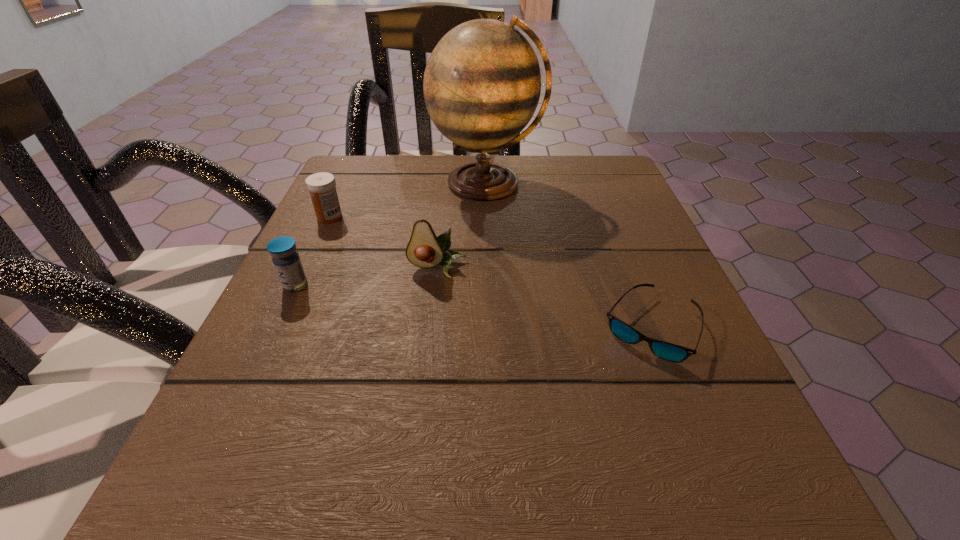
Where is `the tallest object`? The width and height of the screenshot is (960, 540). the tallest object is located at coordinates (482, 83).

Where is `avocado`? The height and width of the screenshot is (540, 960). avocado is located at coordinates (425, 250).

Image resolution: width=960 pixels, height=540 pixels. I want to click on the farther medicine, so click(321, 186).

The width and height of the screenshot is (960, 540). Identify the location of the nearer medicine. (286, 260).

Where is `the shortest object`? This screenshot has height=540, width=960. the shortest object is located at coordinates (667, 351).

Find the location of a particular element. The height and width of the screenshot is (540, 960). the rightmost object is located at coordinates (667, 351).

Locate an element on the screen. The image size is (960, 540). blank space located 0.240m on the front-facing side of the tallest object is located at coordinates (489, 291).

I want to click on vacant space located 0.380m on the seed side of the fourth shortest object, so click(409, 518).

You are a GUI agent. You are given a task and a screenshot of the screen. Output one action in this format:
    pyautogui.click(x=<x>, y=<y>)
    Task: Click on the vacant space positioned 0.080m on the front of the farther medicine
    Image resolution: width=960 pixels, height=540 pixels.
    Given the screenshot: What is the action you would take?
    pyautogui.click(x=315, y=249)

The width and height of the screenshot is (960, 540). I want to click on vacant space located on the front of the nearer medicine, so click(200, 488).